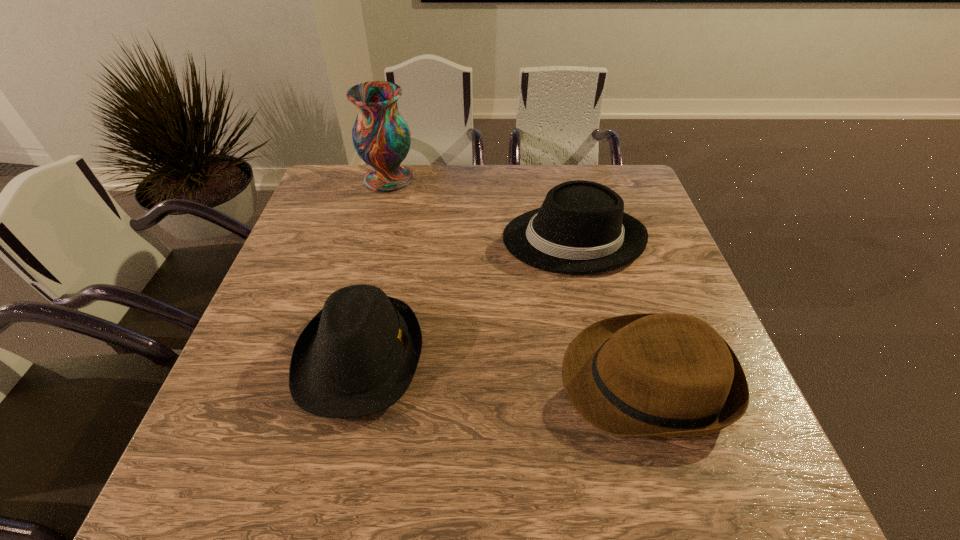
The height and width of the screenshot is (540, 960). I want to click on fedora that is at the far edge, so click(x=581, y=228).

You are a GUI agent. You are given a task and a screenshot of the screen. Output one action in this format:
    pyautogui.click(x=<x>, y=<y>)
    Task: Click on the vase that is positioned at the left edge
    The image size is (960, 540).
    Given the screenshot: What is the action you would take?
    pyautogui.click(x=381, y=137)

Identify the location of fedora that is at the left edge. (358, 355).

You are a GUI agent. You are given a task and a screenshot of the screen. Output one action in this format:
    pyautogui.click(x=<x>, y=<y>)
    Task: Click on the object located in the far left corner section of the desktop
    Image resolution: width=960 pixels, height=540 pixels.
    Given the screenshot: What is the action you would take?
    pyautogui.click(x=381, y=137)

Find the location of a particular element. The width and height of the screenshot is (960, 540). object at the far right corner is located at coordinates pyautogui.click(x=581, y=228).

Where is `blank space at the far edge`? blank space at the far edge is located at coordinates (492, 176).

Where is `vacant space at the near edge of the desktop`? vacant space at the near edge of the desktop is located at coordinates (318, 483).

You are a GUI agent. You are given a task and a screenshot of the screen. Output one action in this format:
    pyautogui.click(x=<x>, y=<y>)
    Task: Click on the vacant space at the left edge of the desktop
    Image resolution: width=960 pixels, height=540 pixels.
    Given the screenshot: What is the action you would take?
    pyautogui.click(x=327, y=239)

Identify the location of free space at the right edge. The width and height of the screenshot is (960, 540). (682, 299).

You are a GUI agent. You are given a task and a screenshot of the screen. Output one action in this format:
    pyautogui.click(x=<x>, y=<y>)
    Task: Click on the free region at the near left corner of the desktop
    
    Given the screenshot: What is the action you would take?
    pyautogui.click(x=203, y=478)